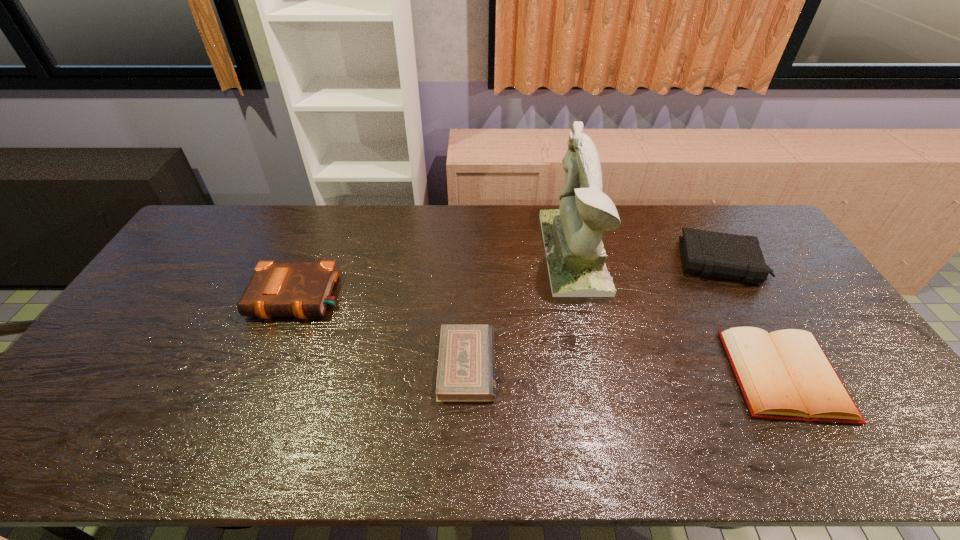
You are a GUI agent. You are given a task and a screenshot of the screen. Output one action in this format:
    pyautogui.click(x=<x>, y=<y>)
    Task: Click on the free space located on the back of the fourth tallest object
    This screenshot has width=960, height=540.
    Given the screenshot: What is the action you would take?
    pyautogui.click(x=708, y=243)

Find the location of a particular element. vacant space located on the spine side of the second Bible from left to right is located at coordinates (608, 364).

Where is `sculpture located at the far edge`? sculpture located at the far edge is located at coordinates (572, 235).

The width and height of the screenshot is (960, 540). Find the location of `Bible that is at the far edge`. Bible that is at the far edge is located at coordinates (707, 253).

Find the location of a particular element. This screenshot has height=540, width=960. object positioned at the far right corner is located at coordinates (707, 253).

Image resolution: width=960 pixels, height=540 pixels. Find the location of `vacant space at the far edge of the desktop`. vacant space at the far edge of the desktop is located at coordinates (324, 239).

This screenshot has width=960, height=540. In the image, there is a desktop. What are the coordinates of `free space at the near edge` in the screenshot? It's located at (732, 429).

You are a GUI agent. You are given a task and a screenshot of the screen. Output one action in this format:
    pyautogui.click(x=<x>, y=<y>)
    Task: Click on the free space at the left edge
    
    Given the screenshot: What is the action you would take?
    pyautogui.click(x=176, y=265)

You are a GUI agent. You are given a task and a screenshot of the screen. Output one action in this format:
    pyautogui.click(x=<x>, y=<y>)
    Task: Click on the unoccupied position between the sculpture and the shortest Bible
    Image resolution: width=960 pixels, height=540 pixels.
    Given the screenshot: What is the action you would take?
    pyautogui.click(x=520, y=308)

In order to click on free spot between the sculpture and the shortest Bible in this screenshot , I will do `click(520, 308)`.